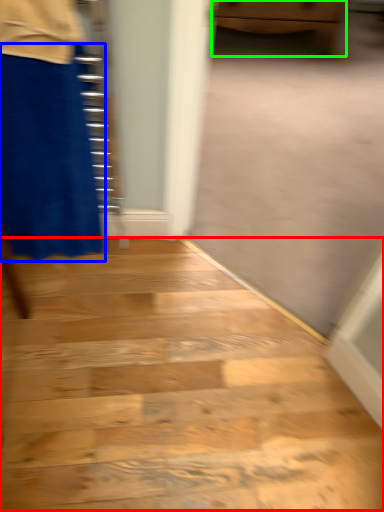
Question: Considering the real-world distances, which object is closest to stairwell (highlighted by a red box)? miniskirt (highlighted by a blue box) or furniture (highlighted by a green box).

Choices:
 (A) miniskirt
 (B) furniture

Answer: (A)